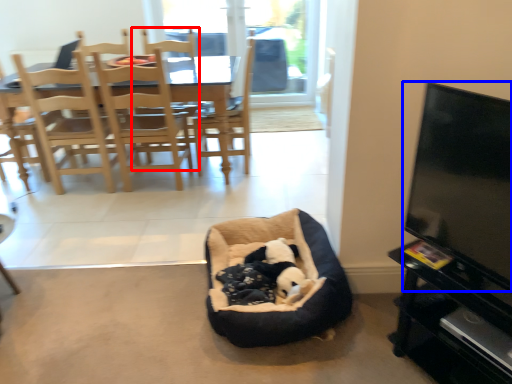
Question: Among these objects, which one is farthest to the camera, armchair (highlighted by a red box) or television (highlighted by a blue box)?

Choices:
 (A) armchair
 (B) television

Answer: (A)